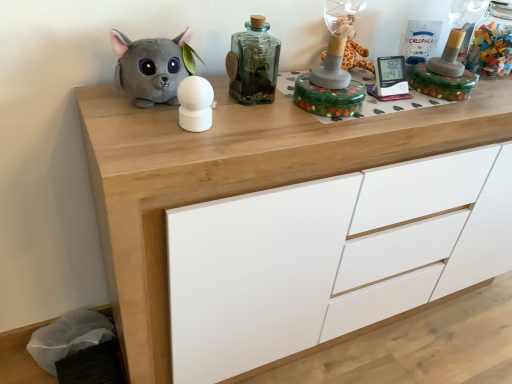
What do you see at coordinates (195, 104) in the screenshot? I see `white matte sphere at center, which is the 2th toy from right to left` at bounding box center [195, 104].

Where is `translucent glass bottle at center, marked as the second bottle in a right-to-left arrangement`? The width and height of the screenshot is (512, 384). translucent glass bottle at center, marked as the second bottle in a right-to-left arrangement is located at coordinates (253, 63).

This screenshot has width=512, height=384. Describe the element at coordinates (253, 63) in the screenshot. I see `translucent glass bottle at center, the first bottle when ordered from left to right` at that location.

The width and height of the screenshot is (512, 384). What do you see at coordinates (152, 67) in the screenshot?
I see `gray plush toy at left, which ranks as the 1th toy in left-to-right order` at bounding box center [152, 67].

Measure the distance between wooden chest of drawers at center and camera.

wooden chest of drawers at center and camera are 29.55 inches apart from each other.

This screenshot has height=384, width=512. Identify the location of green floral box at center, acting as the 1th toy starting from the right. (333, 68).

At what (x,y) coordinates should I click in order to perform the action: click on transparent glass jar at upper right, which is the second bottle from left to right. Please return your answer as a coordinate pair (x, y). The height and width of the screenshot is (384, 512). Looking at the image, I should click on (492, 42).

Identify the location of white matte sphere at center, which is the 2th toy from right to left. (195, 104).

Is green floral box at center, acting as the 1th toy starting from the right, wider than gray plush toy at left, the third toy in the right-to-left sequence?

Indeed, green floral box at center, acting as the 1th toy starting from the right, has a greater width compared to gray plush toy at left, the third toy in the right-to-left sequence.

Is green floral box at center, the third toy positioned from the left, in front of or behind gray plush toy at left, which ranks as the 1th toy in left-to-right order, in the image?

Clearly, green floral box at center, the third toy positioned from the left, is behind gray plush toy at left, which ranks as the 1th toy in left-to-right order.

Is green floral box at center, the third toy positioned from the left, facing towards gray plush toy at left, which ranks as the 1th toy in left-to-right order?

No, green floral box at center, the third toy positioned from the left, is not turned towards gray plush toy at left, which ranks as the 1th toy in left-to-right order.

Based on the photo, which of these two, green floral box at center, acting as the 1th toy starting from the right, or gray plush toy at left, the third toy in the right-to-left sequence, stands shorter?

green floral box at center, acting as the 1th toy starting from the right, is shorter.

Is gray plush toy at left, the third toy in the right-to-left sequence, at the back of transparent glass jar at upper right, the 2th bottle positioned from the front?

No.

There is a gray plush toy at left, which ranks as the 1th toy in left-to-right order. Where is `the 2nd bottle above it (from a real-world perspective)`? The width and height of the screenshot is (512, 384). the 2nd bottle above it (from a real-world perspective) is located at coordinates (492, 42).

Considering the relative positions of transparent glass jar at upper right, the first bottle when ordered from right to left, and gray plush toy at left, which ranks as the 1th toy in left-to-right order, in the image provided, is transparent glass jar at upper right, the first bottle when ordered from right to left, to the right of gray plush toy at left, which ranks as the 1th toy in left-to-right order, from the viewer's perspective?

Yes.

Is white matte sphere at center, the 2th toy from the left, smaller than transparent glass jar at upper right, which is the first bottle in back-to-front order?

Yes.

Does white matte sphere at center, which is the 2th toy from right to left, have a greater width compared to transparent glass jar at upper right, which is the first bottle in back-to-front order?

Incorrect, the width of white matte sphere at center, which is the 2th toy from right to left, does not surpass that of transparent glass jar at upper right, which is the first bottle in back-to-front order.

From a real-world perspective, which object stands above the other?

transparent glass jar at upper right, the first bottle when ordered from right to left, from a real-world perspective.

Is point (180, 83) positioned before point (490, 36)?

Yes, it is in front of point (490, 36).

From a real-world perspective, which object rests below the other?

wooden chest of drawers at center, from a real-world perspective.

Considering the relative sizes of wooden chest of drawers at center and gray plush toy at left, the third toy in the right-to-left sequence, in the image provided, is wooden chest of drawers at center taller than gray plush toy at left, the third toy in the right-to-left sequence,?

Correct, wooden chest of drawers at center is much taller as gray plush toy at left, the third toy in the right-to-left sequence.

The height and width of the screenshot is (384, 512). In the image, there is a gray plush toy at left, the third toy in the right-to-left sequence. Identify the location of the chest of drawers below it (from the image's perspective). (232, 178).

Is wooden chest of drawers at center located outside gray plush toy at left, which ranks as the 1th toy in left-to-right order?

wooden chest of drawers at center lies outside gray plush toy at left, which ranks as the 1th toy in left-to-right order,'s area.

Where is `toy on the right of translucent glass bottle at center, the first bottle when ordered from left to right`? toy on the right of translucent glass bottle at center, the first bottle when ordered from left to right is located at coordinates (333, 68).

Which is correct: green floral box at center, acting as the 1th toy starting from the right, is inside translucent glass bottle at center, marked as the second bottle in a right-to-left arrangement, or outside of it?

The correct answer is: outside.

Does point (343, 0) come in front of point (275, 50)?

That is False.

Is green floral box at center, the third toy positioned from the left, wider than translucent glass bottle at center, marked as the second bottle in a right-to-left arrangement?

Indeed, green floral box at center, the third toy positioned from the left, has a greater width compared to translucent glass bottle at center, marked as the second bottle in a right-to-left arrangement.

Considering the positions of points (335, 52) and (473, 64), is point (335, 52) farther from camera compared to point (473, 64)?

No.

Between green floral box at center, the third toy positioned from the left, and transparent glass jar at upper right, the first bottle when ordered from right to left, which one has less height?

Standing shorter between the two is green floral box at center, the third toy positioned from the left.

Is green floral box at center, acting as the 1th toy starting from the right, located outside transparent glass jar at upper right, which is the second bottle from left to right?

Yes, green floral box at center, acting as the 1th toy starting from the right, is outside of transparent glass jar at upper right, which is the second bottle from left to right.

Is white matte sphere at center, the 2th toy from the left, to the left or to the right of gray plush toy at left, the third toy in the right-to-left sequence, in the image?

In the image, white matte sphere at center, the 2th toy from the left, appears on the right side of gray plush toy at left, the third toy in the right-to-left sequence.

In the scene shown: How far apart are white matte sphere at center, which is the 2th toy from right to left, and gray plush toy at left, which ranks as the 1th toy in left-to-right order?

white matte sphere at center, which is the 2th toy from right to left, and gray plush toy at left, which ranks as the 1th toy in left-to-right order, are 4.13 inches apart from each other.

Is white matte sphere at center, the 2th toy from the left, wider than gray plush toy at left, which ranks as the 1th toy in left-to-right order?

No.

Based on the photo, is white matte sphere at center, the 2th toy from the left, further to camera compared to gray plush toy at left, the third toy in the right-to-left sequence?

No, it is in front of gray plush toy at left, the third toy in the right-to-left sequence.

Image resolution: width=512 pixels, height=384 pixels. There is a gray plush toy at left, the third toy in the right-to-left sequence. Find the location of `the 1st toy below it (from a real-world perspective)`. the 1st toy below it (from a real-world perspective) is located at coordinates click(333, 68).

The image size is (512, 384). What are the coordinates of `the 2nd bottle counting from the right side of the gray plush toy at left, which ranks as the 1th toy in left-to-right order` in the screenshot? It's located at (492, 42).

Considering their positions, is transparent glass jar at upper right, which is the second bottle from left to right, positioned closer to white matte sphere at center, the 2th toy from the left, than gray plush toy at left, the third toy in the right-to-left sequence?

gray plush toy at left, the third toy in the right-to-left sequence.

Estimate the real-world distances between objects in this image. Which object is closer to transparent glass jar at upper right, which is the second bottle from left to right, green floral box at center, acting as the 1th toy starting from the right, or wooden chest of drawers at center?

green floral box at center, acting as the 1th toy starting from the right, is closer to transparent glass jar at upper right, which is the second bottle from left to right.

Estimate the real-world distances between objects in this image. Which object is closer to wooden chest of drawers at center, white matte sphere at center, which is the 2th toy from right to left, or transparent glass jar at upper right, which is the second bottle from left to right?

The object closer to wooden chest of drawers at center is white matte sphere at center, which is the 2th toy from right to left.

Considering their positions, is translucent glass bottle at center, the first bottle when ordered from left to right, positioned further to white matte sphere at center, which is the 2th toy from right to left, than green floral box at center, the third toy positioned from the left?

green floral box at center, the third toy positioned from the left, is positioned further to the anchor white matte sphere at center, which is the 2th toy from right to left.

From the image, which object appears to be farther from wooden chest of drawers at center, translucent glass bottle at center, the first bottle when ordered from left to right, or gray plush toy at left, which ranks as the 1th toy in left-to-right order?

gray plush toy at left, which ranks as the 1th toy in left-to-right order, is positioned further to the anchor wooden chest of drawers at center.

Considering their positions, is green floral box at center, acting as the 1th toy starting from the right, positioned further to translucent glass bottle at center, the 1th bottle positioned from the front, than white matte sphere at center, the 2th toy from the left?

The object further to translucent glass bottle at center, the 1th bottle positioned from the front, is white matte sphere at center, the 2th toy from the left.

Estimate the real-world distances between objects in this image. Which object is closer to gray plush toy at left, the third toy in the right-to-left sequence, translucent glass bottle at center, marked as the second bottle in a right-to-left arrangement, or white matte sphere at center, the 2th toy from the left?

Based on the image, white matte sphere at center, the 2th toy from the left, appears to be nearer to gray plush toy at left, the third toy in the right-to-left sequence.

Based on their spatial positions, is green floral box at center, the third toy positioned from the left, or wooden chest of drawers at center further from white matte sphere at center, which is the 2th toy from right to left?

green floral box at center, the third toy positioned from the left, lies further to white matte sphere at center, which is the 2th toy from right to left, than the other object.

At what (x,y) coordinates should I click in order to perform the action: click on toy located between gray plush toy at left, which ranks as the 1th toy in left-to-right order, and translucent glass bottle at center, the 1th bottle positioned from the front, in the left-right direction. Please return your answer as a coordinate pair (x, y). The height and width of the screenshot is (384, 512). Looking at the image, I should click on (195, 104).

The height and width of the screenshot is (384, 512). I want to click on bottle situated between gray plush toy at left, the third toy in the right-to-left sequence, and green floral box at center, the third toy positioned from the left, from left to right, so click(x=253, y=63).

Where is `bottle between white matte sphere at center, which is the 2th toy from right to left, and transparent glass jar at upper right, the first bottle when ordered from right to left`? This screenshot has height=384, width=512. bottle between white matte sphere at center, which is the 2th toy from right to left, and transparent glass jar at upper right, the first bottle when ordered from right to left is located at coordinates (253, 63).

This screenshot has width=512, height=384. Identify the location of toy located between translucent glass bottle at center, marked as the second bottle in a right-to-left arrangement, and transparent glass jar at upper right, which is the second bottle from left to right, in the left-right direction. (333, 68).